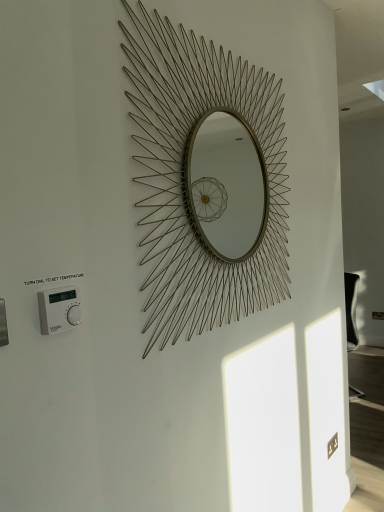
At what (x,y) coordinates should I click in order to perform the action: click on white plastic thermostat at lower left. Please return your answer as a coordinate pair (x, y). This screenshot has width=384, height=512. Looking at the image, I should click on (59, 309).

What do you see at coordinates (59, 309) in the screenshot?
I see `white plastic thermostat at lower left` at bounding box center [59, 309].

What is the approximate width of white plastic thermostat at lower left?

white plastic thermostat at lower left is 1.14 inches wide.

Describe the element at coordinates (205, 179) in the screenshot. I see `gold wire mirror at center` at that location.

Where is `gold wire mirror at center`? gold wire mirror at center is located at coordinates (205, 179).

Measure the distance between gold wire mirror at center and camera.

gold wire mirror at center is 1.02 meters from camera.

What is the approximate width of gold wire mirror at center?

It is 4.10 centimeters.

Locate an element on the screen. This screenshot has height=512, width=384. white plastic thermostat at lower left is located at coordinates (59, 309).

Consider the image. Between white plastic thermostat at lower left and gold wire mirror at center, which one appears on the left side from the viewer's perspective?

Positioned to the left is white plastic thermostat at lower left.

Is white plastic thermostat at lower left in front of or behind gold wire mirror at center in the image?

white plastic thermostat at lower left is in front of gold wire mirror at center.

Considering the points (52, 293) and (224, 156), which point is in front, point (52, 293) or point (224, 156)?

The point (52, 293) is closer.

From the image's perspective, who appears lower, white plastic thermostat at lower left or gold wire mirror at center?

white plastic thermostat at lower left, from the image's perspective.

From a real-world perspective, relative to gold wire mirror at center, is white plastic thermostat at lower left vertically above or below?

Clearly, from a real-world perspective, white plastic thermostat at lower left is below gold wire mirror at center.

Does white plastic thermostat at lower left have a greater width compared to gold wire mirror at center?

In fact, white plastic thermostat at lower left might be narrower than gold wire mirror at center.

Considering the sizes of objects white plastic thermostat at lower left and gold wire mirror at center in the image provided, who is shorter, white plastic thermostat at lower left or gold wire mirror at center?

Standing shorter between the two is white plastic thermostat at lower left.

Looking at this image, between white plastic thermostat at lower left and gold wire mirror at center, which one has larger size?

gold wire mirror at center.

Is white plastic thermostat at lower left inside or outside of gold wire mirror at center?

The correct answer is: outside.

Is the surface of white plastic thermostat at lower left in direct contact with gold wire mirror at center?

No, white plastic thermostat at lower left is not beside gold wire mirror at center.

Is white plastic thermostat at lower left oriented away from gold wire mirror at center?

No, gold wire mirror at center is not at the back of white plastic thermostat at lower left.

This screenshot has width=384, height=512. I want to click on thermostat on the left of gold wire mirror at center, so click(59, 309).

Which object is positioned more to the left, gold wire mirror at center or white plastic thermostat at lower left?

white plastic thermostat at lower left is more to the left.

Is gold wire mirror at center closer to camera compared to white plastic thermostat at lower left?

No, it is not.

Which point is more forward, [218,220] or [40,322]?

The point [40,322] is closer to the camera.

From the image's perspective, is gold wire mirror at center positioned above or below white plastic thermostat at lower left?

Based on their image positions, gold wire mirror at center is located above white plastic thermostat at lower left.

From a real-world perspective, does gold wire mirror at center sit lower than white plastic thermostat at lower left?

Incorrect, from a real-world perspective, gold wire mirror at center is higher than white plastic thermostat at lower left.

Looking at their sizes, would you say gold wire mirror at center is wider or thinner than white plastic thermostat at lower left?

gold wire mirror at center is wider than white plastic thermostat at lower left.

Who is taller, gold wire mirror at center or white plastic thermostat at lower left?

gold wire mirror at center is taller.

Between gold wire mirror at center and white plastic thermostat at lower left, which one has larger size?

gold wire mirror at center.

Is gold wire mirror at center outside of white plastic thermostat at lower left?

Absolutely, gold wire mirror at center is external to white plastic thermostat at lower left.

Is gold wire mirror at center far away from white plastic thermostat at lower left?

No, there isn't a large distance between gold wire mirror at center and white plastic thermostat at lower left.

Is gold wire mirror at center positioned with its back to white plastic thermostat at lower left?

No, gold wire mirror at center's orientation is not away from white plastic thermostat at lower left.

What's the angular difference between gold wire mirror at center and white plastic thermostat at lower left's facing directions?

The angular difference between gold wire mirror at center and white plastic thermostat at lower left is 0.264 degrees.

The image size is (384, 512). Find the location of `thermostat located in front of the gold wire mirror at center`. thermostat located in front of the gold wire mirror at center is located at coordinates (59, 309).

This screenshot has width=384, height=512. I want to click on oval that is above the white plastic thermostat at lower left (from the image's perspective), so click(x=205, y=179).

Image resolution: width=384 pixels, height=512 pixels. In order to click on oval on the right of white plastic thermostat at lower left in this screenshot , I will do `click(205, 179)`.